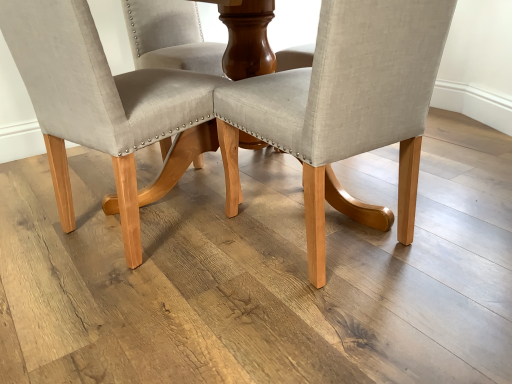
At what (x,y) coordinates should I click in order to perform the action: click on free region under beige fabric chair at center, placed as the 1th chair when sorted from right to left (from a real-world perspective). Please return your answer as a coordinate pair (x, y). The height and width of the screenshot is (384, 512). Looking at the image, I should click on (324, 231).